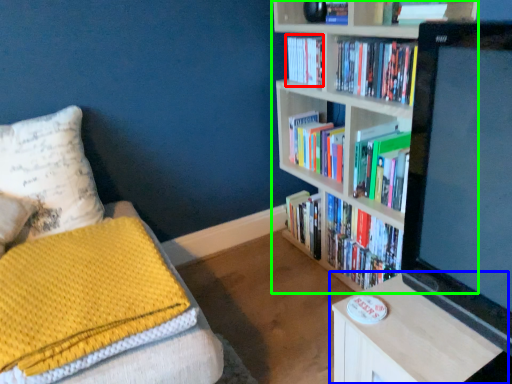
Question: Considering the real-world distances, which object is closest to book (highlighted by a red box)? table (highlighted by a blue box) or bookcase (highlighted by a green box).

Choices:
 (A) table
 (B) bookcase

Answer: (B)